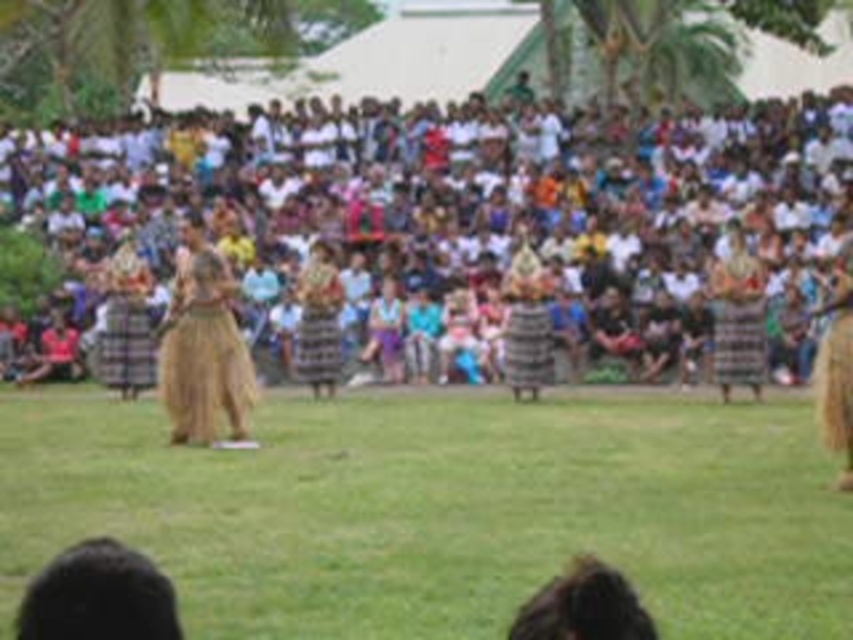
Question: Is white woven fabric crowd at upper center closer to the viewer compared to textured brown skirt at right?

Choices:
 (A) no
 (B) yes

Answer: (A)

Question: Based on their relative distances, which object is farther from the textured brown skirt at right?

Choices:
 (A) textured woven skirt at center
 (B) white woven fabric crowd at upper center
 (C) brown woven skirt at right
 (D) brown woven skirt at center

Answer: (D)

Question: Which object is farther from the camera taking this photo?

Choices:
 (A) brown woven skirt at center
 (B) textured woven skirt at center
 (C) brown woven skirt at right

Answer: (B)

Question: From the image, what is the correct spatial relationship of brown woven skirt at center in relation to textured woven skirt at center?

Choices:
 (A) left
 (B) right

Answer: (A)

Question: Does plaid fabric skirt at left appear over textured woven skirt at center?

Choices:
 (A) no
 (B) yes

Answer: (A)

Question: Which of the following is the closest to the observer?

Choices:
 (A) green grass at center
 (B) plaid fabric skirt at left

Answer: (A)